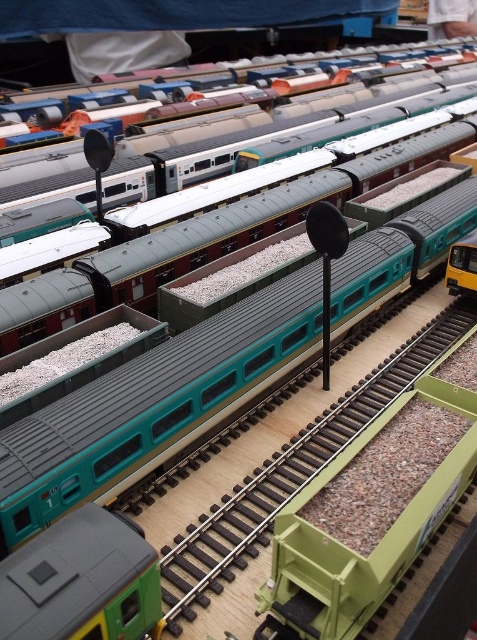
Consider the image. Is green rubber train track at center shorter than green matte train car at bottom left?

In fact, green rubber train track at center may be taller than green matte train car at bottom left.

Who is positioned more to the left, green rubber train track at center or green matte train car at bottom left?

green matte train car at bottom left

At what (x,y) coordinates should I click in order to perform the action: click on green rubber train track at center. Please return your answer as a coordinate pair (x, y). Looking at the image, I should click on tap(291, 474).